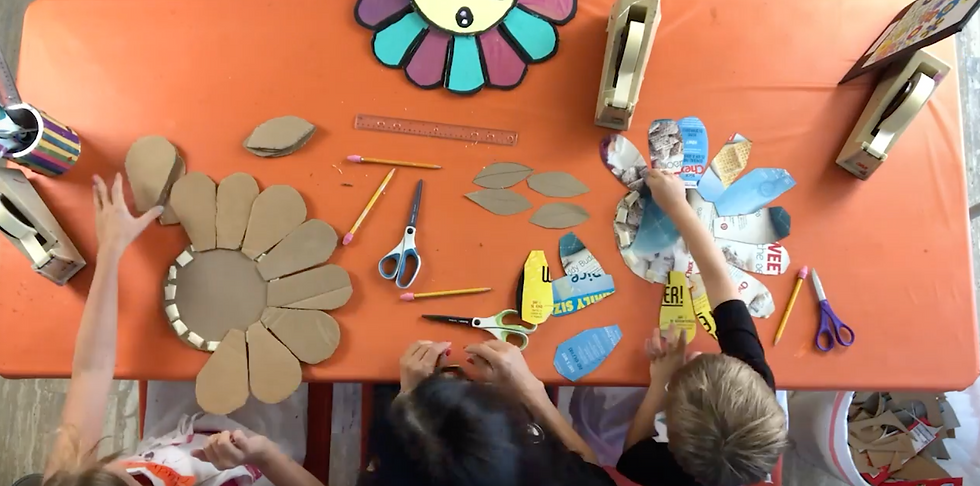
Locate an element on the screen. This screenshot has width=980, height=486. trash is located at coordinates (909, 417).